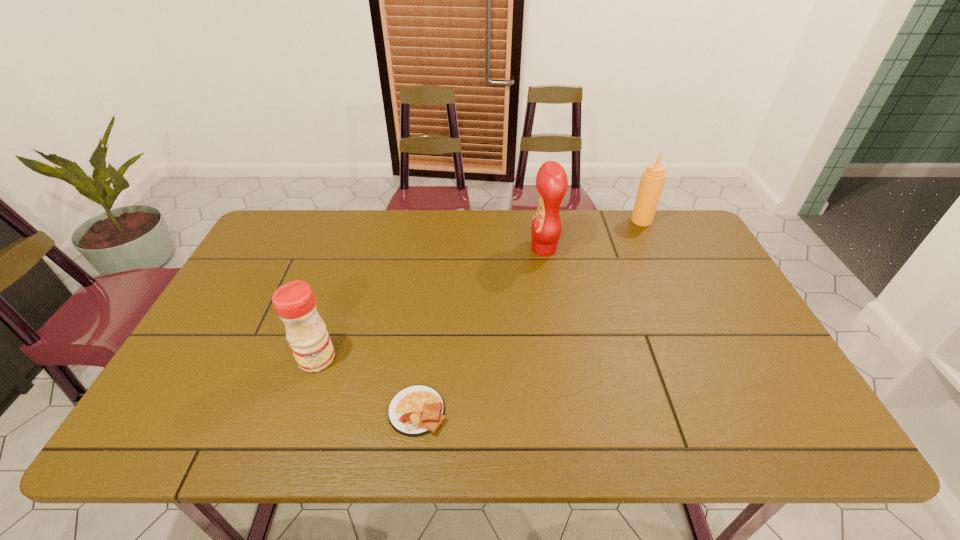
The height and width of the screenshot is (540, 960). Find the location of `free space located 0.250m on the label side of the second condiment from left to right`. free space located 0.250m on the label side of the second condiment from left to right is located at coordinates (451, 248).

Locate an element on the screen. free space located 0.050m on the right of the rightmost condiment is located at coordinates (666, 220).

The image size is (960, 540). I want to click on vacant space situated on the right of the nearest condiment, so click(383, 359).

The image size is (960, 540). I want to click on vacant space located on the back of the shortest object, so click(x=426, y=338).

Identify the location of object situated at the near edge. Image resolution: width=960 pixels, height=540 pixels. (417, 410).

You are a GUI agent. You are given a task and a screenshot of the screen. Output one action in this format:
    pyautogui.click(x=<x>, y=<y>)
    Task: Click on the object located in the right edge section of the desktop
    The image size is (960, 540).
    Given the screenshot: What is the action you would take?
    pyautogui.click(x=653, y=178)

Identify the location of object that is positioned at the far right corner. The height and width of the screenshot is (540, 960). (653, 178).

Find the location of a particular element. vacant space at the far edge of the desktop is located at coordinates (423, 247).

Locate an element on the screen. This screenshot has width=960, height=540. free space at the near edge of the desktop is located at coordinates (252, 426).

Image resolution: width=960 pixels, height=540 pixels. Find the location of `vacant area at the left edge of the desktop`. vacant area at the left edge of the desktop is located at coordinates (202, 365).